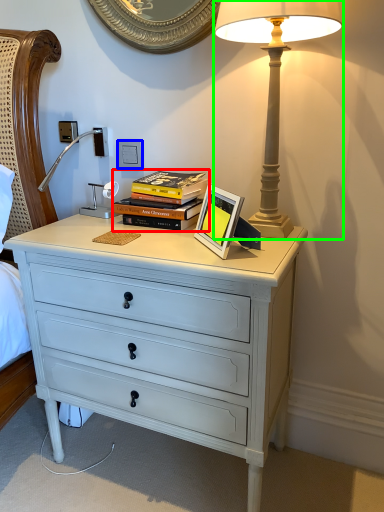
Question: Which object is the closest to the book (highlighted by a red box)? Choose among these: electric outlet (highlighted by a blue box) or lamp (highlighted by a green box).

Choices:
 (A) electric outlet
 (B) lamp

Answer: (A)